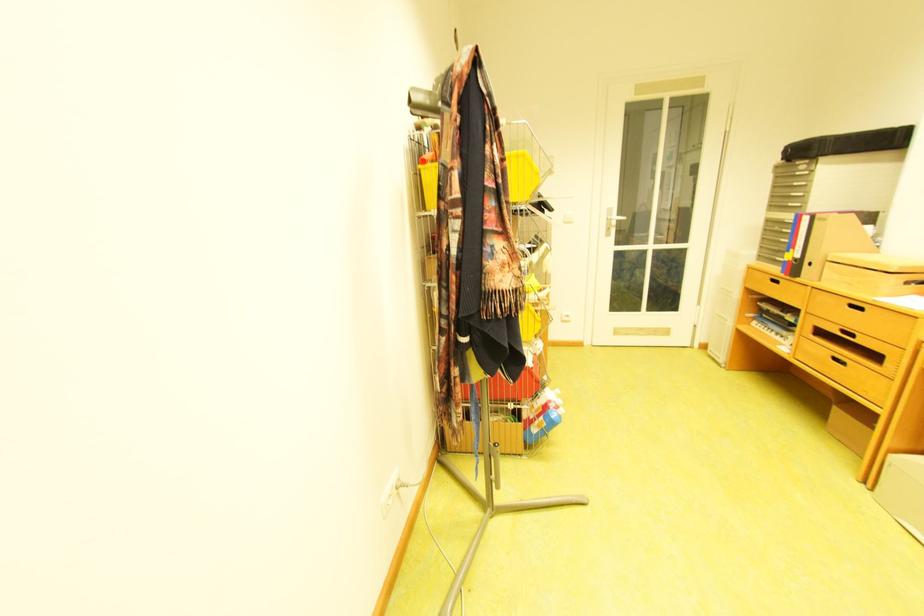
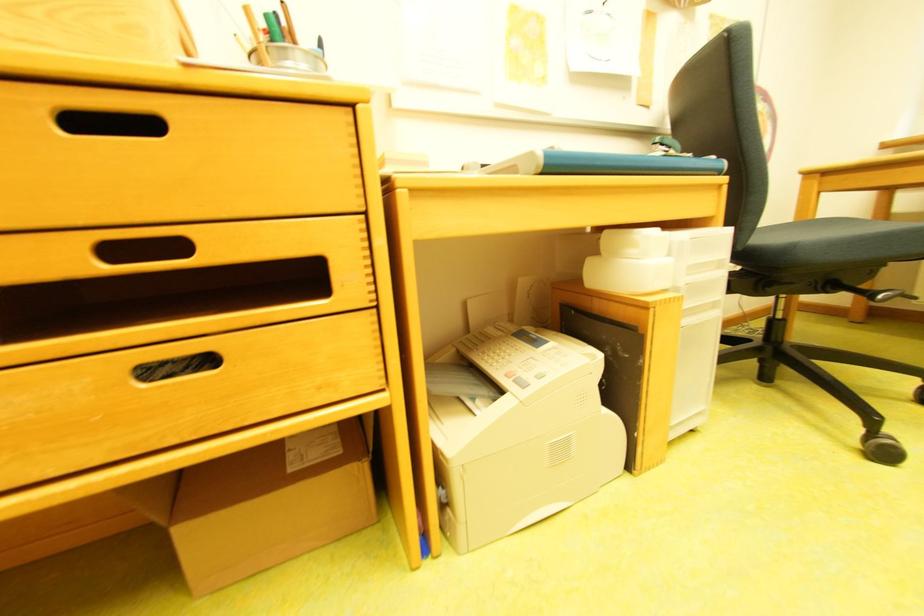
Locate, in the second image, the point that corresponds to the point at 864,337 in the first image.

(189, 246)